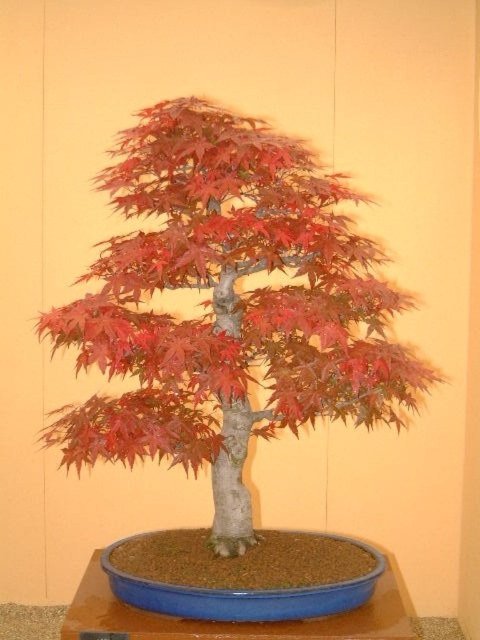
Looking at this image, you are a gardener who needs to water the bonsai tree. The blue plastic tray at center is used to catch excess water. When you water the matte red bonsai tree at center, where will the water likely flow? Please explain your reasoning.

The water will flow into the blue plastic tray at center because the matte red bonsai tree at center is positioned above it, and gravity will cause the excess water to drain downward into the tray.

You are an interior designer planning to place a small decorative item next to the bonsai tree. Given the size relationship between the matte red bonsai tree at center and the blue plastic tray at center, which object should you choose to place closer to the smaller one to maintain visual balance?

The blue plastic tray at center is smaller than the matte red bonsai tree at center. To maintain visual balance, place the small decorative item closer to the blue plastic tray at center since it is smaller.

You are arranging a display for a plant exhibition and need to place a small decorative stone between the matte red bonsai tree at center and the blue plastic tray at center. Based on their positions, where should you place the stone?

The matte red bonsai tree at center is to the left of the blue plastic tray at center, so you should place the small decorative stone between them on the right side of the bonsai tree and the left side of the tray.